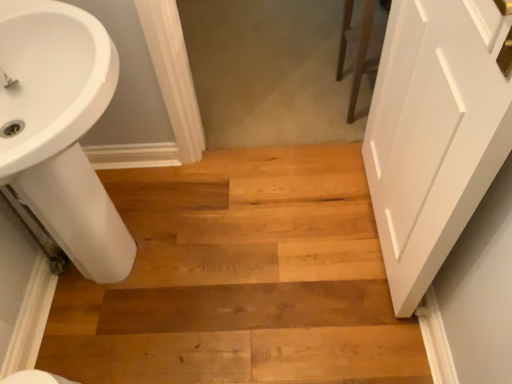
Image resolution: width=512 pixels, height=384 pixels. Identify the location of white glossy sink at lower left. (60, 129).

Between white matte door at right and white glossy sink at lower left, which one appears on the left side from the viewer's perspective?

white glossy sink at lower left is more to the left.

Is white matte door at right facing away from white glossy sink at lower left?

No.

Which of these two, white matte door at right or white glossy sink at lower left, stands shorter?

white glossy sink at lower left is shorter.

Measure the distance between natural wood floor at center and white matte door at right.

natural wood floor at center and white matte door at right are 19.64 inches apart from each other.

Which object is wider, natural wood floor at center or white matte door at right?

natural wood floor at center.

From a real-world perspective, which object stands above the other?

white matte door at right.

Would you say natural wood floor at center contains white glossy sink at lower left?

No, white glossy sink at lower left is not a part of natural wood floor at center.

Is natural wood floor at center aimed at white glossy sink at lower left?

No, natural wood floor at center is not facing towards white glossy sink at lower left.

Is natural wood floor at center shorter than white glossy sink at lower left?

Yes.

From the image's perspective, between natural wood floor at center and white glossy sink at lower left, who is located below?

natural wood floor at center appears lower in the image.

Does white matte door at right have a greater width compared to natural wood floor at center?

Incorrect, the width of white matte door at right does not surpass that of natural wood floor at center.

Considering the sizes of objects white matte door at right and natural wood floor at center in the image provided, who is smaller, white matte door at right or natural wood floor at center?

With smaller size is white matte door at right.

From the image's perspective, which object appears higher, white matte door at right or natural wood floor at center?

white matte door at right is shown above in the image.

Looking at this image, is white glossy sink at lower left facing away from natural wood floor at center?

No, white glossy sink at lower left's orientation is not away from natural wood floor at center.

Which is closer to the camera, (78,90) or (320,170)?

The point (78,90) is closer.

Consider the image. From a real-world perspective, is white glossy sink at lower left positioned over natural wood floor at center based on gravity?

Yes, from a real-world perspective, white glossy sink at lower left is on top of natural wood floor at center.

From the image's perspective, which object appears higher, white glossy sink at lower left or white matte door at right?

white matte door at right appears higher in the image.

Considering the sizes of objects white glossy sink at lower left and white matte door at right in the image provided, who is shorter, white glossy sink at lower left or white matte door at right?

white glossy sink at lower left.

Which object is more forward, white glossy sink at lower left or white matte door at right?

white matte door at right is more forward.

Locate an element on the screen. door located above the white glossy sink at lower left (from a real-world perspective) is located at coordinates (435, 133).

Locate an element on the screen. The width and height of the screenshot is (512, 384). door lying in front of the natural wood floor at center is located at coordinates (435, 133).

Looking at the image, which one is located closer to natural wood floor at center, white matte door at right or white glossy sink at lower left?

white glossy sink at lower left is closer to natural wood floor at center.

Estimate the real-world distances between objects in this image. Which object is further from white matte door at right, white glossy sink at lower left or natural wood floor at center?

white glossy sink at lower left is positioned further to the anchor white matte door at right.

When comparing their distances from white glossy sink at lower left, does white matte door at right or natural wood floor at center seem closer?

natural wood floor at center lies closer to white glossy sink at lower left than the other object.

When comparing their distances from white glossy sink at lower left, does natural wood floor at center or white matte door at right seem further?

The object further to white glossy sink at lower left is white matte door at right.

From the picture: From the image, which object appears to be nearer to natural wood floor at center, white glossy sink at lower left or white matte door at right?

Based on the image, white glossy sink at lower left appears to be nearer to natural wood floor at center.

When comparing their distances from white matte door at right, does natural wood floor at center or white glossy sink at lower left seem further?

Among the two, white glossy sink at lower left is located further to white matte door at right.

Locate an element on the screen. Image resolution: width=512 pixels, height=384 pixels. stairwell between white glossy sink at lower left and white matte door at right from left to right is located at coordinates (240, 279).